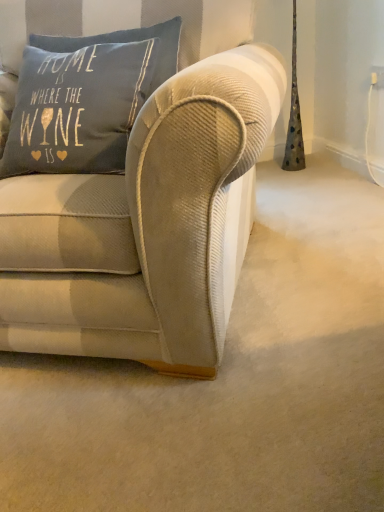
What do you see at coordinates (149, 208) in the screenshot?
I see `beige corduroy couch at center` at bounding box center [149, 208].

In order to face textured gray pillow at upper left, which ranks as the second pillow in bottom-to-top order, should I rotate leftwards or rightwards?

Turn left by 14.385 degrees to look at textured gray pillow at upper left, which ranks as the second pillow in bottom-to-top order.

Where is `beige corduroy couch at center`? beige corduroy couch at center is located at coordinates (149, 208).

Measure the distance from blue cotton pillow at upper left, the 1th pillow from the bottom, to textured gray pillow at upper left, which ranks as the second pillow in bottom-to-top order.

blue cotton pillow at upper left, the 1th pillow from the bottom, and textured gray pillow at upper left, which ranks as the second pillow in bottom-to-top order, are 6.07 inches apart from each other.

From a real-world perspective, is blue cotton pillow at upper left, which is the 2th pillow in top-to-bottom order, physically below textured gray pillow at upper left, which is the first pillow from top to bottom?

Yes.

Can you tell me how much blue cotton pillow at upper left, the 1th pillow from the bottom, and textured gray pillow at upper left, which is the first pillow from top to bottom, differ in facing direction?

There is a 1.7-degree angle between the facing directions of blue cotton pillow at upper left, the 1th pillow from the bottom, and textured gray pillow at upper left, which is the first pillow from top to bottom.

From the picture: From the image's perspective, between blue cotton pillow at upper left, the 1th pillow from the bottom, and textured gray pillow at upper left, which is the first pillow from top to bottom, who is located below?

blue cotton pillow at upper left, the 1th pillow from the bottom, appears lower in the image.

How many degrees apart are the facing directions of blue cotton pillow at upper left, the 1th pillow from the bottom, and beige corduroy couch at center?

The angular difference between blue cotton pillow at upper left, the 1th pillow from the bottom, and beige corduroy couch at center is 0.982 degrees.

Considering the points (7, 159) and (151, 224), which point is behind, point (7, 159) or point (151, 224)?

The point (7, 159) is farther from the camera.

Consider the image. Which of these two, blue cotton pillow at upper left, which is the 2th pillow in top-to-bottom order, or beige corduroy couch at center, is wider?

beige corduroy couch at center.

Is blue cotton pillow at upper left, which is the 2th pillow in top-to-bottom order, closer to camera compared to beige corduroy couch at center?

No, blue cotton pillow at upper left, which is the 2th pillow in top-to-bottom order, is further to the viewer.

From the image's perspective, is beige corduroy couch at center on top of blue cotton pillow at upper left, which is the 2th pillow in top-to-bottom order?

No, from the image's perspective, beige corduroy couch at center is not on top of blue cotton pillow at upper left, which is the 2th pillow in top-to-bottom order.

The image size is (384, 512). What are the coordinates of `the 1st pillow behind the beige corduroy couch at center` in the screenshot? It's located at click(x=77, y=108).

Is beige corduroy couch at center not close to blue cotton pillow at upper left, which is the 2th pillow in top-to-bottom order?

No, beige corduroy couch at center is in close proximity to blue cotton pillow at upper left, which is the 2th pillow in top-to-bottom order.

Does beige corduroy couch at center appear on the left side of blue cotton pillow at upper left, which is the 2th pillow in top-to-bottom order?

Indeed, beige corduroy couch at center is positioned on the left side of blue cotton pillow at upper left, which is the 2th pillow in top-to-bottom order.

Is textured gray pillow at upper left, which is the first pillow from top to bottom, shorter than blue cotton pillow at upper left, which is the 2th pillow in top-to-bottom order?

Indeed, textured gray pillow at upper left, which is the first pillow from top to bottom, has a lesser height compared to blue cotton pillow at upper left, which is the 2th pillow in top-to-bottom order.

Is textured gray pillow at upper left, which ranks as the second pillow in bottom-to-top order, placed right next to blue cotton pillow at upper left, which is the 2th pillow in top-to-bottom order?

No, textured gray pillow at upper left, which ranks as the second pillow in bottom-to-top order, is not making contact with blue cotton pillow at upper left, which is the 2th pillow in top-to-bottom order.

Is textured gray pillow at upper left, which ranks as the second pillow in bottom-to-top order, oriented towards blue cotton pillow at upper left, which is the 2th pillow in top-to-bottom order?

Yes, textured gray pillow at upper left, which ranks as the second pillow in bottom-to-top order, faces towards blue cotton pillow at upper left, which is the 2th pillow in top-to-bottom order.

How distant is textured gray pillow at upper left, which is the first pillow from top to bottom, from blue cotton pillow at upper left, the 1th pillow from the bottom?

15.42 centimeters.

From a real-world perspective, is textured gray pillow at upper left, which ranks as the second pillow in bottom-to-top order, positioned over beige corduroy couch at center based on gravity?

Correct, in the physical world, textured gray pillow at upper left, which ranks as the second pillow in bottom-to-top order, is higher than beige corduroy couch at center.

At what (x,y) coordinates should I click in order to perform the action: click on studio couch below the textured gray pillow at upper left, which ranks as the second pillow in bottom-to-top order (from a real-world perspective). Please return your answer as a coordinate pair (x, y). The image size is (384, 512). Looking at the image, I should click on (149, 208).

Considering the relative sizes of textured gray pillow at upper left, which is the first pillow from top to bottom, and beige corduroy couch at center in the image provided, is textured gray pillow at upper left, which is the first pillow from top to bottom, thinner than beige corduroy couch at center?

Correct, the width of textured gray pillow at upper left, which is the first pillow from top to bottom, is less than that of beige corduroy couch at center.

Can you tell me how much beige corduroy couch at center and textured gray pillow at upper left, which is the first pillow from top to bottom, differ in facing direction?

They differ by 2.68 degrees in their facing directions.

The height and width of the screenshot is (512, 384). Identify the location of studio couch located in front of the textured gray pillow at upper left, which is the first pillow from top to bottom. (149, 208).

From the image's perspective, is beige corduroy couch at center under textured gray pillow at upper left, which is the first pillow from top to bottom?

Indeed, from the image's perspective, beige corduroy couch at center is shown beneath textured gray pillow at upper left, which is the first pillow from top to bottom.

Is point (5, 275) closer to camera compared to point (158, 86)?

Yes, point (5, 275) is in front of point (158, 86).

The image size is (384, 512). Find the location of `pillow on the right of blue cotton pillow at upper left, which is the 2th pillow in top-to-bottom order`. pillow on the right of blue cotton pillow at upper left, which is the 2th pillow in top-to-bottom order is located at coordinates (126, 42).

What are the coordinates of `studio couch below the blue cotton pillow at upper left, which is the 2th pillow in top-to-bottom order (from a real-world perspective)` in the screenshot? It's located at (149, 208).

Looking at the image, which one is located closer to beige corduroy couch at center, blue cotton pillow at upper left, which is the 2th pillow in top-to-bottom order, or textured gray pillow at upper left, which is the first pillow from top to bottom?

blue cotton pillow at upper left, which is the 2th pillow in top-to-bottom order, is closer to beige corduroy couch at center.

From the image, which object appears to be nearer to textured gray pillow at upper left, which is the first pillow from top to bottom, blue cotton pillow at upper left, which is the 2th pillow in top-to-bottom order, or beige corduroy couch at center?

Based on the image, blue cotton pillow at upper left, which is the 2th pillow in top-to-bottom order, appears to be nearer to textured gray pillow at upper left, which is the first pillow from top to bottom.

Looking at the image, which one is located further to blue cotton pillow at upper left, which is the 2th pillow in top-to-bottom order, beige corduroy couch at center or textured gray pillow at upper left, which is the first pillow from top to bottom?

beige corduroy couch at center is further to blue cotton pillow at upper left, which is the 2th pillow in top-to-bottom order.

When comparing their distances from beige corduroy couch at center, does textured gray pillow at upper left, which ranks as the second pillow in bottom-to-top order, or blue cotton pillow at upper left, which is the 2th pillow in top-to-bottom order, seem further?

Based on the image, textured gray pillow at upper left, which ranks as the second pillow in bottom-to-top order, appears to be further to beige corduroy couch at center.

Considering their positions, is beige corduroy couch at center positioned further to textured gray pillow at upper left, which ranks as the second pillow in bottom-to-top order, than blue cotton pillow at upper left, which is the 2th pillow in top-to-bottom order?

beige corduroy couch at center is further to textured gray pillow at upper left, which ranks as the second pillow in bottom-to-top order.

Which object lies further to the anchor point blue cotton pillow at upper left, which is the 2th pillow in top-to-bottom order, textured gray pillow at upper left, which ranks as the second pillow in bottom-to-top order, or beige corduroy couch at center?

beige corduroy couch at center is further to blue cotton pillow at upper left, which is the 2th pillow in top-to-bottom order.

Identify the location of pillow between beige corduroy couch at center and textured gray pillow at upper left, which is the first pillow from top to bottom, along the z-axis. This screenshot has width=384, height=512. (77, 108).